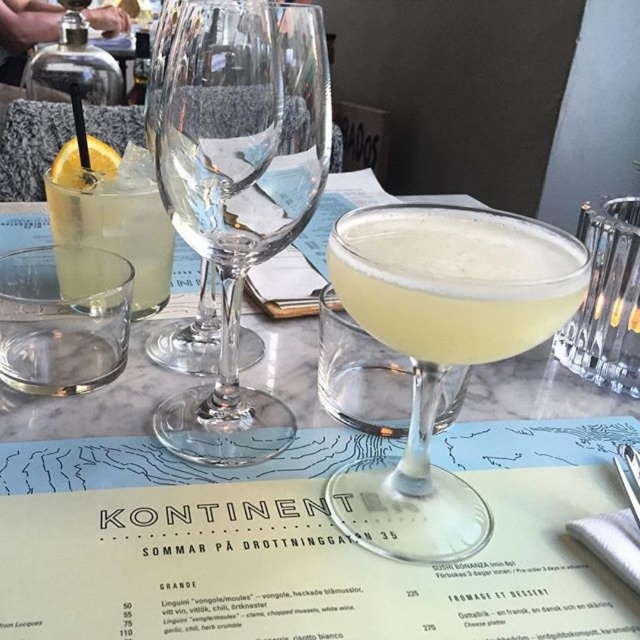
Between clear glass cocktail at center and transparent glass wine glass at center, which one is positioned lower?

clear glass cocktail at center is below.

Can you confirm if clear glass cocktail at center is taller than transparent glass wine glass at center?

No.

The image size is (640, 640). Find the location of `clear glass cocktail at center`. clear glass cocktail at center is located at coordinates (273, 531).

Locate an element on the screen. Image resolution: width=640 pixels, height=640 pixels. clear glass cocktail at center is located at coordinates (273, 531).

Is transparent glass wine glass at center closer to camera compared to translucent glass cocktail at center?

No, it is not.

Does point (296, 77) come closer to viewer compared to point (378, 326)?

No, it is behind (378, 326).

Who is more forward, (x=225, y=184) or (x=428, y=268)?

Positioned in front is point (x=428, y=268).

The height and width of the screenshot is (640, 640). I want to click on transparent glass wine glass at center, so click(x=237, y=195).

Is clear glass cocktail at center to the left of matte yellow cocktail at center from the viewer's perspective?

Yes, clear glass cocktail at center is to the left of matte yellow cocktail at center.

Which is above, clear glass cocktail at center or matte yellow cocktail at center?

Positioned higher is matte yellow cocktail at center.

Does point (305, 579) lie behind point (436, 268)?

Yes, point (305, 579) is farther from viewer.

This screenshot has width=640, height=640. In order to click on clear glass cocktail at center in this screenshot , I will do `click(273, 531)`.